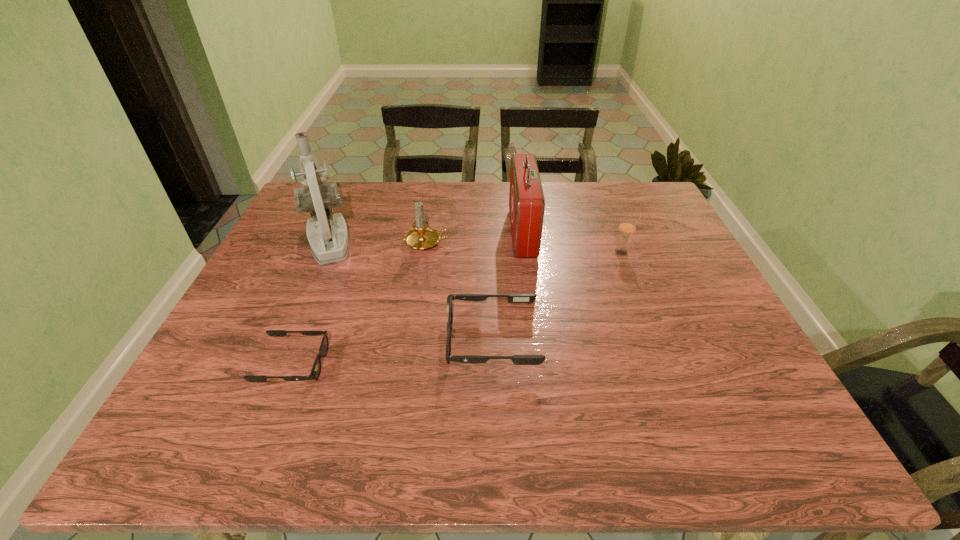
Please point a vacant point for placing a sunglasses on the right. Please provide its 2D coordinates. Your answer should be formatted as a tuple, i.e. [(x, y)], where the tuple contains the x and y coordinates of a point satisfying the conditions above.

[(673, 320)]